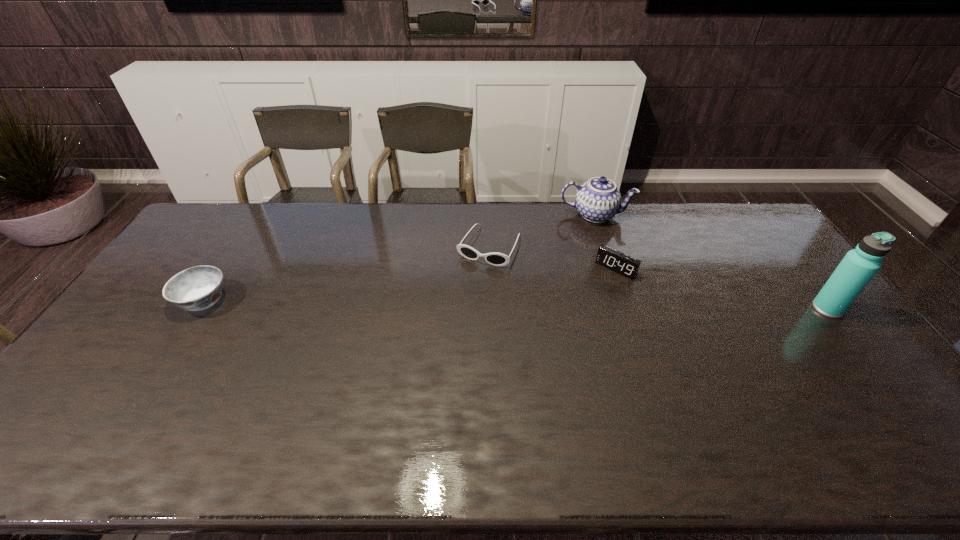
The width and height of the screenshot is (960, 540). In order to click on vacant point located on the front-facing side of the alarm clock in this screenshot , I will do `click(567, 321)`.

The image size is (960, 540). Find the location of `vacant space located 0.380m on the front-facing side of the alarm clock`. vacant space located 0.380m on the front-facing side of the alarm clock is located at coordinates (540, 350).

Where is `vacant space located with the lenses of the shortest object facing outward`? Image resolution: width=960 pixels, height=540 pixels. vacant space located with the lenses of the shortest object facing outward is located at coordinates (438, 338).

Where is `free space located with the lenses of the shortest object facing outward`? This screenshot has height=540, width=960. free space located with the lenses of the shortest object facing outward is located at coordinates (450, 315).

Locate an element on the screen. The height and width of the screenshot is (540, 960). vacant point located 0.100m with the lenses of the shortest object facing outward is located at coordinates (467, 287).

At what (x,y) coordinates should I click in order to perform the action: click on free space located at the spout of the second tallest object. Please return your answer as a coordinate pair (x, y). The height and width of the screenshot is (540, 960). Looking at the image, I should click on (589, 256).

Locate an element on the screen. The image size is (960, 540). blank area located at the spout of the second tallest object is located at coordinates (588, 274).

Identify the location of free region located 0.290m at the spout of the second tallest object. The width and height of the screenshot is (960, 540). (588, 280).

Where is `sunglasses at the far edge`? This screenshot has width=960, height=540. sunglasses at the far edge is located at coordinates (496, 259).

Locate an element on the screen. The image size is (960, 540). chinaware that is at the far edge is located at coordinates (597, 200).